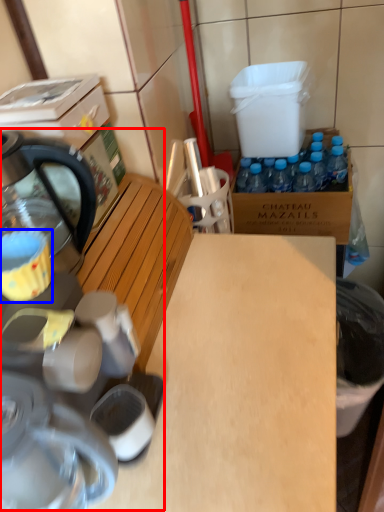
Question: Which point is closer to the camera, coffee machine (highlighted by a red box) or coffee cup (highlighted by a blue box)?

Choices:
 (A) coffee machine
 (B) coffee cup

Answer: (A)